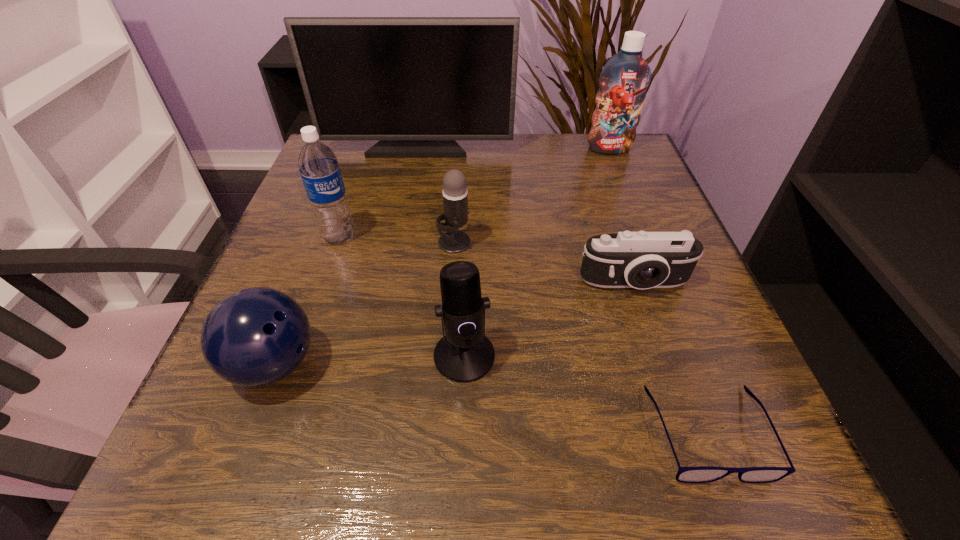
Find the location of a particular element. vacant space situated 0.140m on the front label of the shampoo is located at coordinates (625, 188).

The image size is (960, 540). I want to click on vacant region located on the front of the water bottle, so click(265, 454).

Locate an element on the screen. vacant region located 0.070m on the stand of the nearer microphone is located at coordinates (x=463, y=429).

The image size is (960, 540). Identify the location of vacant region located 0.080m on the front of the farther microphone. (451, 285).

This screenshot has height=540, width=960. I want to click on vacant space located 0.210m on the surface of the bowling ball near the finger holes, so click(x=459, y=364).

Where is `vacant region located 0.230m on the front lens of the camera`? This screenshot has width=960, height=540. vacant region located 0.230m on the front lens of the camera is located at coordinates (683, 429).

The image size is (960, 540). In order to click on monitor at the far edge in this screenshot , I will do `click(417, 84)`.

I want to click on shampoo located at the far edge, so click(625, 77).

Locate an element on the screen. object that is positioned at the near edge is located at coordinates (702, 474).

You are a GUI agent. You are given a task and a screenshot of the screen. Output one action in this format:
    pyautogui.click(x=<x>, y=<y>)
    Task: Click on the monitor located at the left edge
    The image size is (960, 540).
    Given the screenshot: What is the action you would take?
    pyautogui.click(x=417, y=84)